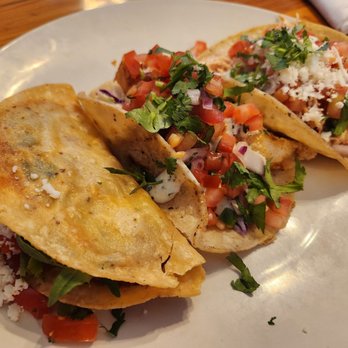
Where is `plate`? plate is located at coordinates (65, 39).